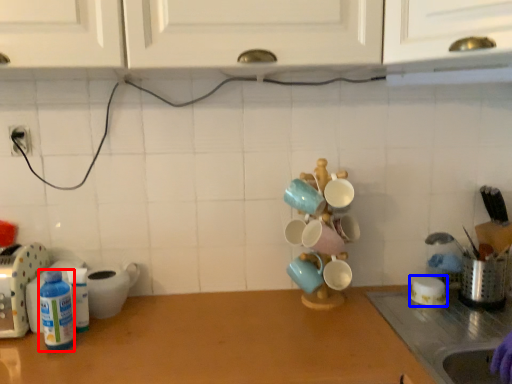
Question: Which of the following is the closest to the observer, bottle (highlighted by a red box) or tableware (highlighted by a blue box)?

Choices:
 (A) bottle
 (B) tableware

Answer: (A)